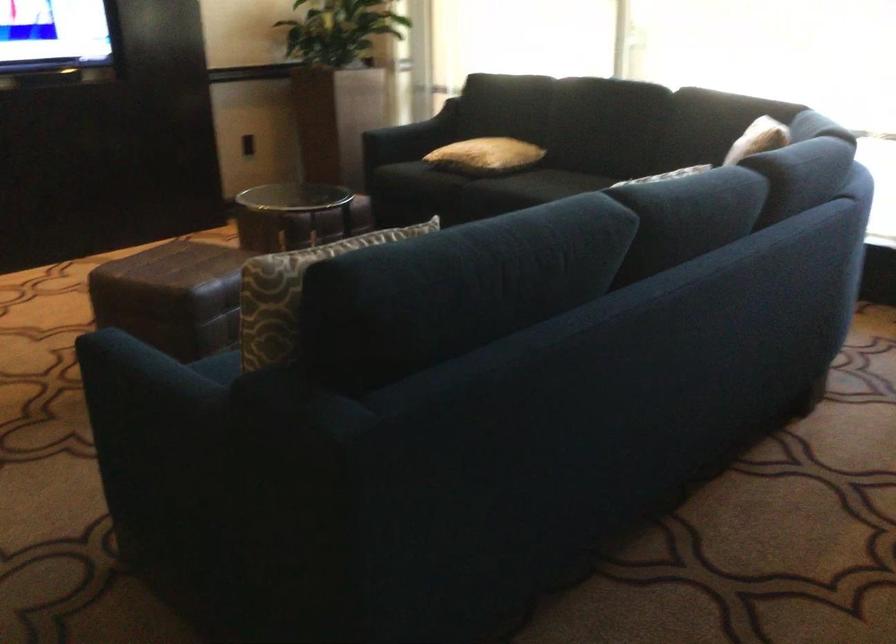
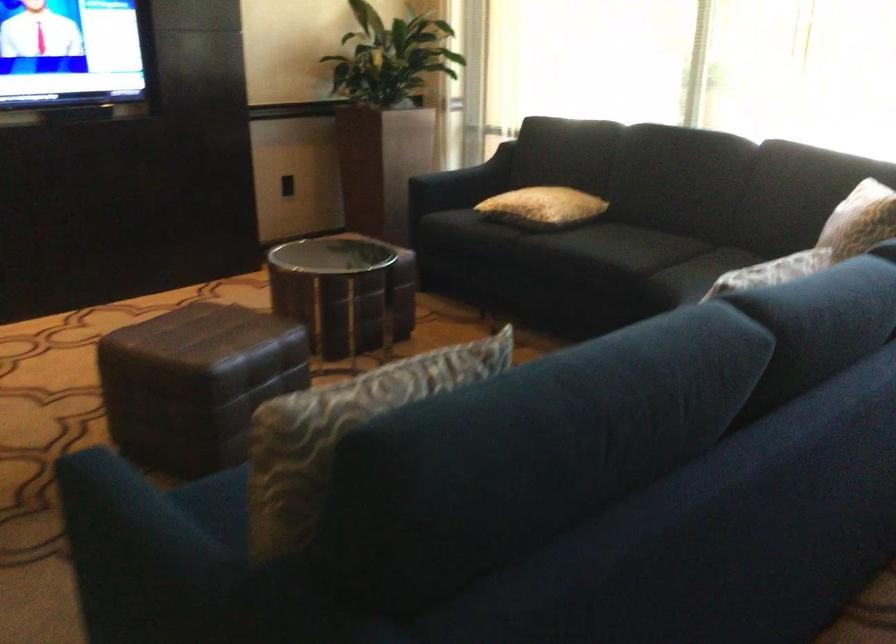
In the second image, find the point that corresponds to [410,138] in the first image.

(460, 184)